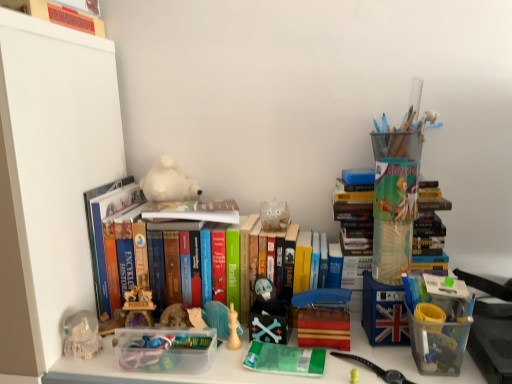
The image size is (512, 384). Describe the element at coordinates (168, 183) in the screenshot. I see `white plush bear at center, the 1th toy from the left` at that location.

Image resolution: width=512 pixels, height=384 pixels. What do you see at coordinates (267, 314) in the screenshot? I see `matte black skull at center, positioned as the 2th toy in top-to-bottom order` at bounding box center [267, 314].

Identify the location of hardcover books at center, the 1th book from the bottom. (110, 238).

This screenshot has height=384, width=512. What do you see at coordinates (110, 238) in the screenshot? I see `hardcover books at center, the 1th book from the bottom` at bounding box center [110, 238].

Where is `white plush bear at center, which is counted as the second toy, starting from the front`? The height and width of the screenshot is (384, 512). white plush bear at center, which is counted as the second toy, starting from the front is located at coordinates (168, 183).

Is matte red monopoly board game at upper left, which ranks as the first book in top-to-bottom order, positioned far away from white plush bear at center, which is counted as the second toy, starting from the front?

matte red monopoly board game at upper left, which ranks as the first book in top-to-bottom order, is near white plush bear at center, which is counted as the second toy, starting from the front, not far away.

Would you say matte red monopoly board game at upper left, placed as the 3th book when sorted from bottom to top, is to the left or to the right of white plush bear at center, the 2th toy from the right, in the picture?

matte red monopoly board game at upper left, placed as the 3th book when sorted from bottom to top, is positioned on white plush bear at center, the 2th toy from the right,'s left side.

Considering the points (16, 3) and (191, 187), which point is behind, point (16, 3) or point (191, 187)?

The point (191, 187) is farther from the camera.

From the picture: From the image's perspective, who appears lower, matte red monopoly board game at upper left, which ranks as the first book in top-to-bottom order, or white plush bear at center, the first toy from the top?

white plush bear at center, the first toy from the top, is shown below in the image.

Can hardcover books at center, the 1th book from the bottom, be found inside matte red monopoly board game at upper left, which ranks as the first book in top-to-bottom order?

That's incorrect, hardcover books at center, the 1th book from the bottom, is not inside matte red monopoly board game at upper left, which ranks as the first book in top-to-bottom order.

The height and width of the screenshot is (384, 512). Find the location of `the 2nd book located above the hardcover books at center, the 1th book from the bottom (from a real-world perspective)`. the 2nd book located above the hardcover books at center, the 1th book from the bottom (from a real-world perspective) is located at coordinates (57, 15).

Which is farther from the camera, (18,0) or (98,243)?

The point (98,243) is farther.

Considering the sizes of matte red monopoly board game at upper left, which ranks as the first book in top-to-bottom order, and hardcover books at center, which is counted as the third book, starting from the top, in the image, is matte red monopoly board game at upper left, which ranks as the first book in top-to-bottom order, bigger or smaller than hardcover books at center, which is counted as the third book, starting from the top,?

In the image, matte red monopoly board game at upper left, which ranks as the first book in top-to-bottom order, appears to be smaller than hardcover books at center, which is counted as the third book, starting from the top.

Is white plush bear at center, acting as the second toy starting from the bottom, far away from matte black skull at center, which is the 1th toy from bottom to top?

Actually, white plush bear at center, acting as the second toy starting from the bottom, and matte black skull at center, which is the 1th toy from bottom to top, are a little close together.

Would you say white plush bear at center, the 2th toy from the right, is outside matte black skull at center, positioned as the 2th toy in back-to-front order?

Indeed, white plush bear at center, the 2th toy from the right, is completely outside matte black skull at center, positioned as the 2th toy in back-to-front order.

From the image's perspective, is white plush bear at center, which ranks as the 1th toy in back-to-front order, on matte black skull at center, which is the first toy from right to left?

Yes, from the image's perspective, white plush bear at center, which ranks as the 1th toy in back-to-front order, is above matte black skull at center, which is the first toy from right to left.

Between white plush bear at center, which ranks as the 1th toy in back-to-front order, and matte black skull at center, positioned as the 2th toy in back-to-front order, which one has more height?

Standing taller between the two is matte black skull at center, positioned as the 2th toy in back-to-front order.

In the scene shown: From the image's perspective, does hardcover books at center, which is counted as the third book, starting from the top, appear higher than matte red monopoly board game at upper left, placed as the 3th book when sorted from bottom to top?

Incorrect, from the image's perspective, hardcover books at center, which is counted as the third book, starting from the top, is lower than matte red monopoly board game at upper left, placed as the 3th book when sorted from bottom to top.

From a real-world perspective, relative to matte red monopoly board game at upper left, which ranks as the first book in top-to-bottom order, is hardcover books at center, the 1th book from the bottom, vertically above or below?

In terms of real-world spatial position, hardcover books at center, the 1th book from the bottom, is below matte red monopoly board game at upper left, which ranks as the first book in top-to-bottom order.

Considering the points (133, 276) and (77, 23), which point is behind, point (133, 276) or point (77, 23)?

Positioned behind is point (133, 276).

Can you confirm if hardcover books at center, which is counted as the third book, starting from the top, is smaller than matte red monopoly board game at upper left, which ranks as the first book in top-to-bottom order?

No, hardcover books at center, which is counted as the third book, starting from the top, is not smaller than matte red monopoly board game at upper left, which ranks as the first book in top-to-bottom order.

Between matte black skull at center, which is the 1th toy from bottom to top, and white plush bear at center, the 2th toy from the right, which one is positioned in front?

matte black skull at center, which is the 1th toy from bottom to top, is closer to the camera.

From the picture: How different are the orientations of matte black skull at center, which is the 1th toy from bottom to top, and white plush bear at center, the 2th toy from the right, in degrees?

0.000803 degrees.

Which point is more distant from viewer, (254, 336) or (140, 184)?

The point (140, 184) is behind.

Is matte black skull at center, which is the first toy from right to left, not inside hardcover books at center, which is counted as the third book, starting from the top?

No, matte black skull at center, which is the first toy from right to left, is not outside of hardcover books at center, which is counted as the third book, starting from the top.

Locate an element on the screen. the 2nd book in front of the matte black skull at center, which is the 1th toy from bottom to top is located at coordinates (110, 238).

From a real-world perspective, who is located lower, matte black skull at center, positioned as the 2th toy in top-to-bottom order, or hardcover books at center, the 1th book from the bottom?

matte black skull at center, positioned as the 2th toy in top-to-bottom order, from a real-world perspective.

Is matte black skull at center, positioned as the 2th toy in top-to-bottom order, facing away from hardcover books at center, the 1th book from the bottom?

Absolutely, matte black skull at center, positioned as the 2th toy in top-to-bottom order, is directed away from hardcover books at center, the 1th book from the bottom.

Between white plush bear at center, which ranks as the 1th toy in back-to-front order, and hardcover book at center, the 2th book viewed from the top, which one has smaller size?

hardcover book at center, the 2th book viewed from the top, is smaller.

How distant is white plush bear at center, which ranks as the 1th toy in back-to-front order, from hardcover book at center, the 2th book viewed from the top?

white plush bear at center, which ranks as the 1th toy in back-to-front order, is 3.53 inches away from hardcover book at center, the 2th book viewed from the top.

Identify the location of toy behind the hardcover book at center, the 2th book viewed from the top. The height and width of the screenshot is (384, 512). (168, 183).

Consider the image. Is white plush bear at center, the first toy from the top, at the right side of hardcover book at center, the second book positioned from the bottom?

No, white plush bear at center, the first toy from the top, is not to the right of hardcover book at center, the second book positioned from the bottom.

From a real-world perspective, count 1st toys downward from the matte red monopoly board game at upper left, which ranks as the first book in top-to-bottom order, and point to it. Please provide its 2D coordinates.

[(168, 183)]

Identify the location of the 2nd book above when counting from the hardcover books at center, the 1th book from the bottom (from the image's perspective). (57, 15).

Looking at the image, which one is located further to matte red monopoly board game at upper left, placed as the 3th book when sorted from bottom to top, hardcover book at center, the 2th book viewed from the top, or matte black skull at center, the 2th toy viewed from the left?

The object further to matte red monopoly board game at upper left, placed as the 3th book when sorted from bottom to top, is matte black skull at center, the 2th toy viewed from the left.

Based on their spatial positions, is hardcover book at center, the 2th book viewed from the top, or matte black skull at center, positioned as the 2th toy in back-to-front order, closer to hardcover books at center, which is counted as the third book, starting from the top?

hardcover book at center, the 2th book viewed from the top, lies closer to hardcover books at center, which is counted as the third book, starting from the top, than the other object.

Based on their spatial positions, is hardcover book at center, the 2th book viewed from the top, or white plush bear at center, the first toy from the top, closer to hardcover books at center, which is counted as the third book, starting from the top?

hardcover book at center, the 2th book viewed from the top, is positioned closer to the anchor hardcover books at center, which is counted as the third book, starting from the top.

Consider the image. Considering their positions, is hardcover books at center, the 1th book from the bottom, positioned closer to matte black skull at center, the 2th toy viewed from the left, than white plush bear at center, acting as the second toy starting from the bottom?

hardcover books at center, the 1th book from the bottom, lies closer to matte black skull at center, the 2th toy viewed from the left, than the other object.

Which object lies further to the anchor point matte red monopoly board game at upper left, which ranks as the first book in top-to-bottom order, hardcover books at center, the 1th book from the bottom, or matte black skull at center, which is the first toy from right to left?

matte black skull at center, which is the first toy from right to left, is positioned further to the anchor matte red monopoly board game at upper left, which ranks as the first book in top-to-bottom order.

Considering their positions, is hardcover book at center, the second book positioned from the bottom, positioned closer to hardcover books at center, the 1th book from the bottom, than matte red monopoly board game at upper left, which ranks as the first book in top-to-bottom order?

hardcover book at center, the second book positioned from the bottom, is positioned closer to the anchor hardcover books at center, the 1th book from the bottom.

Considering their positions, is hardcover book at center, the 2th book viewed from the top, positioned further to matte red monopoly board game at upper left, placed as the 3th book when sorted from bottom to top, than white plush bear at center, the 1th toy from the left?

Among the two, hardcover book at center, the 2th book viewed from the top, is located further to matte red monopoly board game at upper left, placed as the 3th book when sorted from bottom to top.

Which object lies further to the anchor point white plush bear at center, the first toy from the top, hardcover book at center, the 2th book viewed from the top, or matte red monopoly board game at upper left, which ranks as the first book in top-to-bottom order?

Among the two, matte red monopoly board game at upper left, which ranks as the first book in top-to-bottom order, is located further to white plush bear at center, the first toy from the top.

Identify the location of book between hardcover book at center, the 2th book viewed from the top, and matte black skull at center, the 1th toy when ordered from front to back, from top to bottom. (110, 238).

Locate an element on the screen. The height and width of the screenshot is (384, 512). toy between matte red monopoly board game at upper left, which ranks as the first book in top-to-bottom order, and hardcover book at center, the 2th book viewed from the top, vertically is located at coordinates coord(168,183).

This screenshot has width=512, height=384. What are the coordinates of `toy that lies between matte red monopoly board game at upper left, placed as the 3th book when sorted from bottom to top, and matte black skull at center, which is the 1th toy from bottom to top, from top to bottom` in the screenshot? It's located at (168, 183).

At what (x,y) coordinates should I click in order to perform the action: click on book between matte red monopoly board game at upper left, placed as the 3th book when sorted from bottom to top, and hardcover books at center, the 1th book from the bottom, vertically. Please return your answer as a coordinate pair (x, y). Looking at the image, I should click on (193, 211).